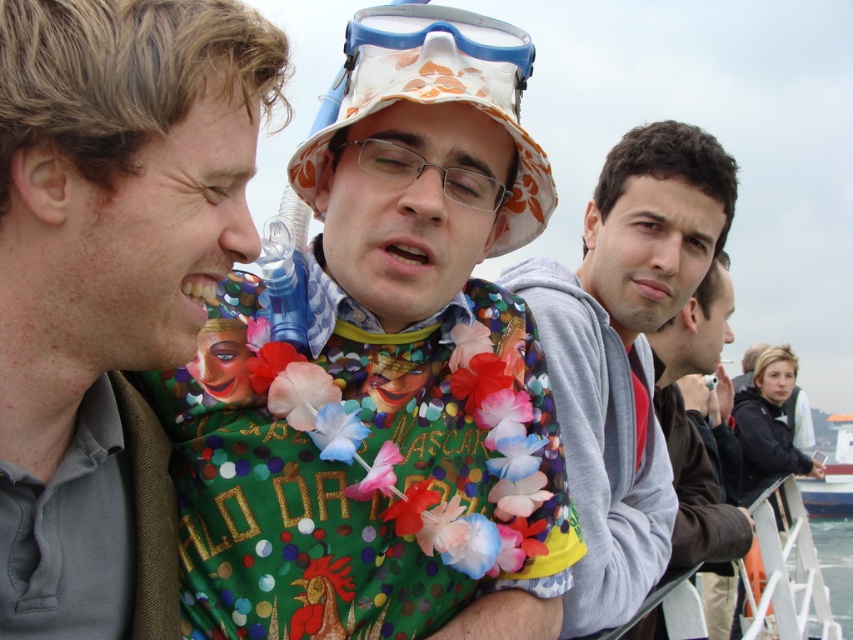
Question: Which object is closer to the camera taking this photo?

Choices:
 (A) green fabric shirt at center
 (B) white plastic boat at lower right

Answer: (A)

Question: Estimate the real-world distances between objects in this image. Which object is farther from the gray fleece jacket at center?

Choices:
 (A) white plastic boat at lower right
 (B) shiny metallic necklace at center
 (C) matte black jacket at right
 (D) green fabric shirt at center

Answer: (A)

Question: Can you confirm if shiny metallic necklace at center is wider than green fabric shirt at center?

Choices:
 (A) yes
 (B) no

Answer: (A)

Question: Can you confirm if gray fleece jacket at center is positioned to the left of matte black jacket at right?

Choices:
 (A) yes
 (B) no

Answer: (A)

Question: In this image, where is gray fleece jacket at center located relative to matte black jacket at right?

Choices:
 (A) above
 (B) below

Answer: (A)

Question: Among these points, which one is nearest to the camera?

Choices:
 (A) (653, 198)
 (B) (724, 616)
 (C) (190, 225)
 (D) (840, 452)

Answer: (C)